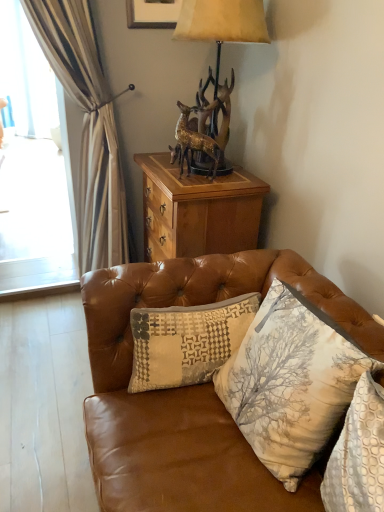
Locate an element on the screen. Image resolution: width=384 pixels, height=512 pixels. free space to the right of gold metallic deer at center is located at coordinates (226, 180).